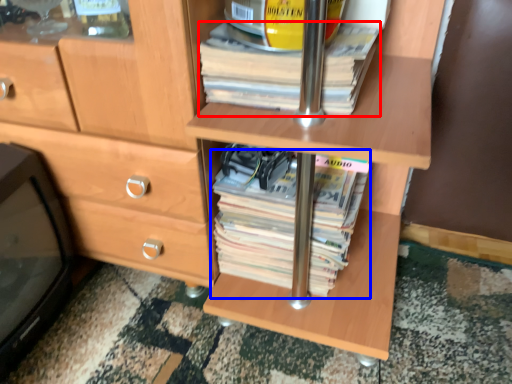
Question: Which point is further to the camera, paperback book (highlighted by a red box) or paperback book (highlighted by a blue box)?

Choices:
 (A) paperback book
 (B) paperback book

Answer: (B)